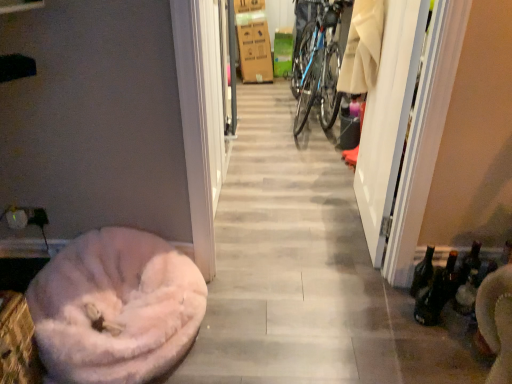
At what (x,y) coordinates should I click in order to perform the action: click on unoccupied space behind white glossy screen door at right. Please return your answer as a coordinate pair (x, y). The height and width of the screenshot is (384, 512). Looking at the image, I should click on (329, 185).